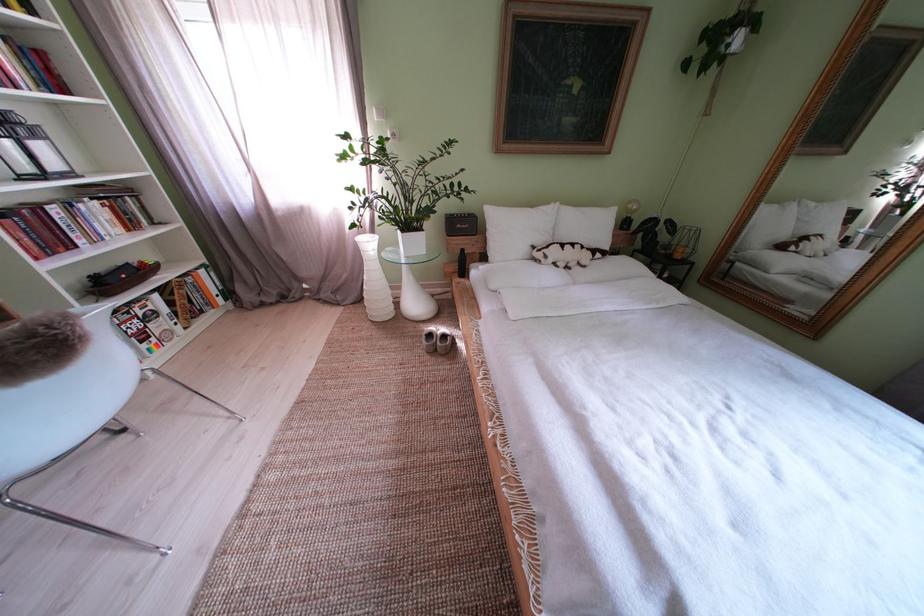
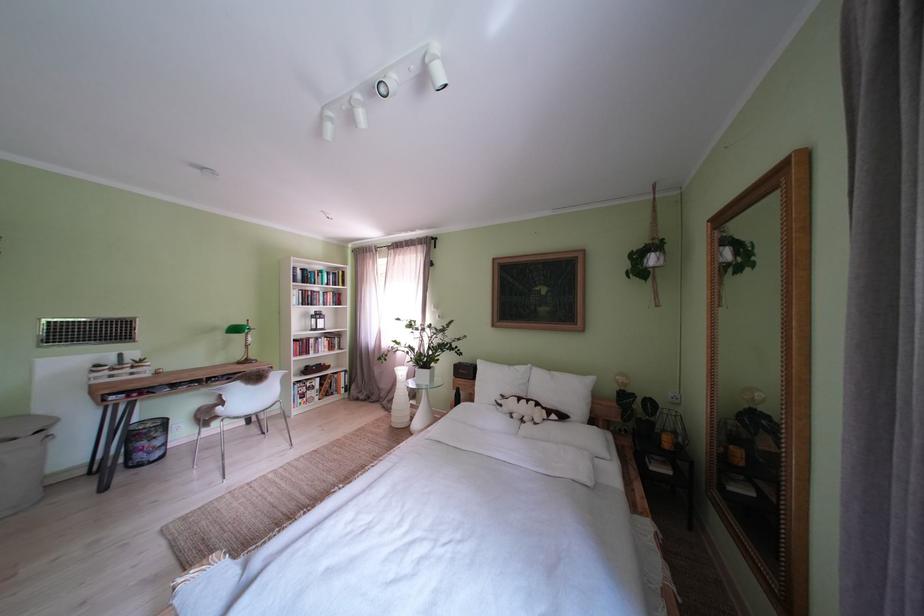
Where in the second image is the point corresponding to (x=556, y=262) from the first image?

(512, 411)